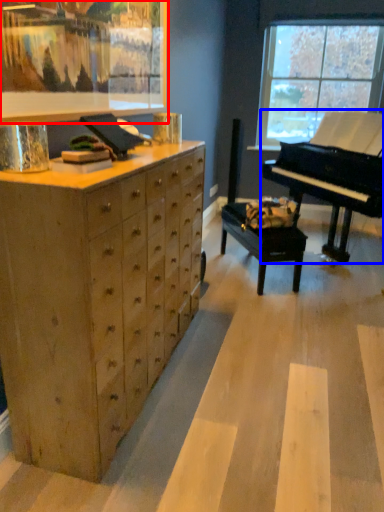
Question: Which point is closer to the camera, picture frame (highlighted by a red box) or piano (highlighted by a blue box)?

Choices:
 (A) picture frame
 (B) piano

Answer: (A)